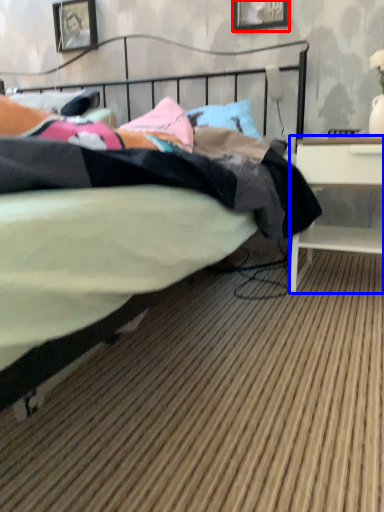
Question: Which object appears closest to the camera in this image, picture frame (highlighted by a red box) or desk (highlighted by a blue box)?

Choices:
 (A) picture frame
 (B) desk

Answer: (B)